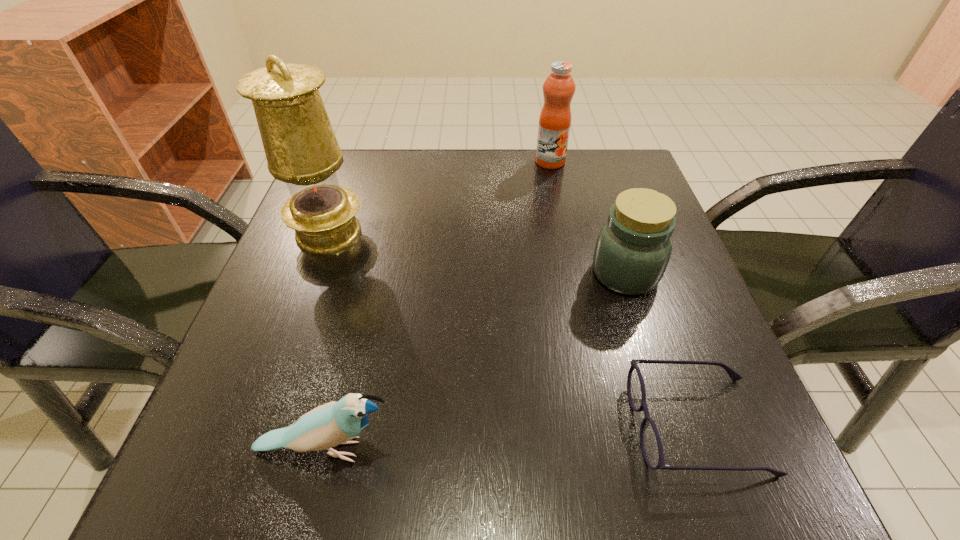
Locate an element on the screen. This screenshot has width=960, height=540. object positioned at the near left corner is located at coordinates (334, 423).

Identify the location of object that is at the near right corner. Image resolution: width=960 pixels, height=540 pixels. (651, 446).

The image size is (960, 540). In order to click on vacant space at the far edge in this screenshot , I will do `click(456, 159)`.

This screenshot has width=960, height=540. Identify the location of vacant space at the near edge of the desktop. (576, 438).

In the image, there is a desktop. Where is `blank space at the left edge`? The image size is (960, 540). blank space at the left edge is located at coordinates (239, 394).

Where is `free spot at the right edge of the desktop`? free spot at the right edge of the desktop is located at coordinates (629, 303).

This screenshot has height=540, width=960. I want to click on free spot at the near left corner of the desktop, so click(x=278, y=467).

Locate an element on the screen. free space at the far right corner of the desktop is located at coordinates (574, 160).

Locate an element on the screen. This screenshot has width=960, height=540. free space between the shortest object and the bird is located at coordinates [512, 437].

Where is `blank region between the jar and the bird`? blank region between the jar and the bird is located at coordinates (476, 361).